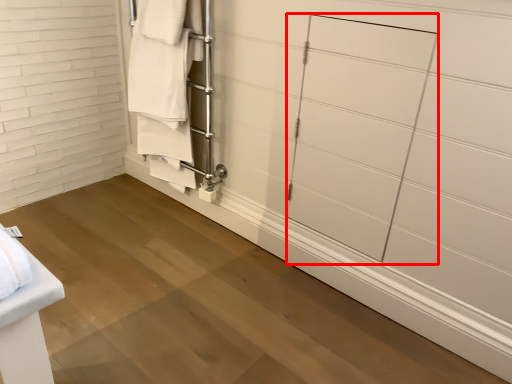
Question: Where is glass door (annotated by the red box) located in relation to closet in the image?

Choices:
 (A) left
 (B) right

Answer: (B)